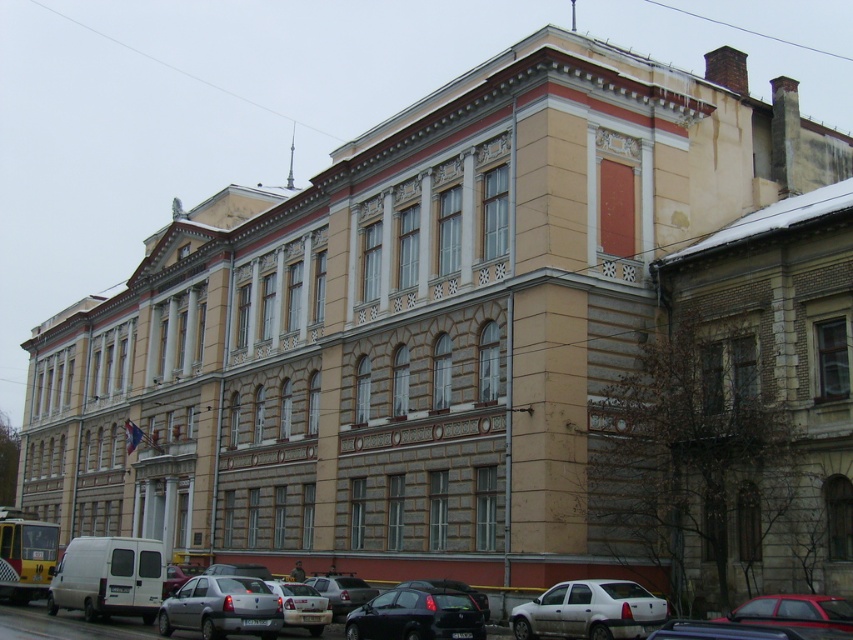
Which is in front, point (624, 596) or point (308, 605)?

Point (624, 596) is more forward.

Does white matte sedan at lower right have a larger size compared to silver metallic sedan at lower center?

Yes.

Is point (605, 609) farther from viewer compared to point (276, 582)?

That is False.

The image size is (853, 640). I want to click on white matte sedan at lower right, so click(589, 611).

Is shiny black car at lower center smaller than shiny red car at lower right?

Indeed, shiny black car at lower center has a smaller size compared to shiny red car at lower right.

Does shiny black car at lower center have a larger size compared to shiny red car at lower right?

Incorrect, shiny black car at lower center is not larger than shiny red car at lower right.

Find the location of a particular element. The width and height of the screenshot is (853, 640). shiny black car at lower center is located at coordinates (416, 616).

Is silver metallic sedan at lower center positioned behind silver metallic sedan at center?

No, it is in front of silver metallic sedan at center.

The height and width of the screenshot is (640, 853). In order to click on silver metallic sedan at lower center in this screenshot , I will do `click(302, 605)`.